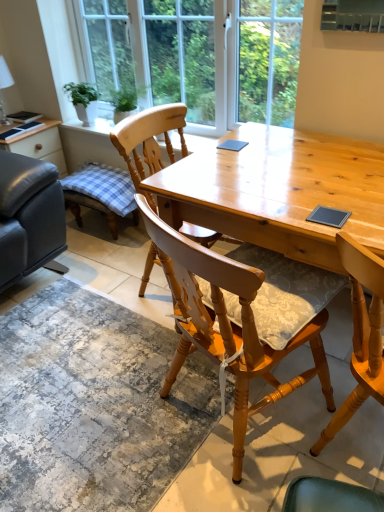
At what (x,y) coordinates should I click in order to perform the action: click on vacant space situated above light brown wooden desk at center (from a real-world perspective). Please return your answer as a coordinate pair (x, y). The height and width of the screenshot is (512, 384). Looking at the image, I should click on (279, 168).